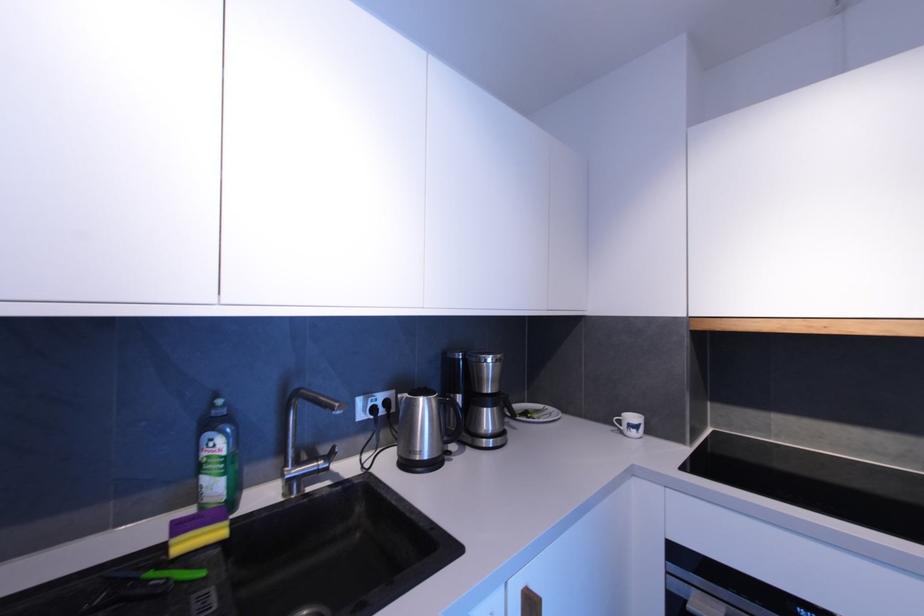
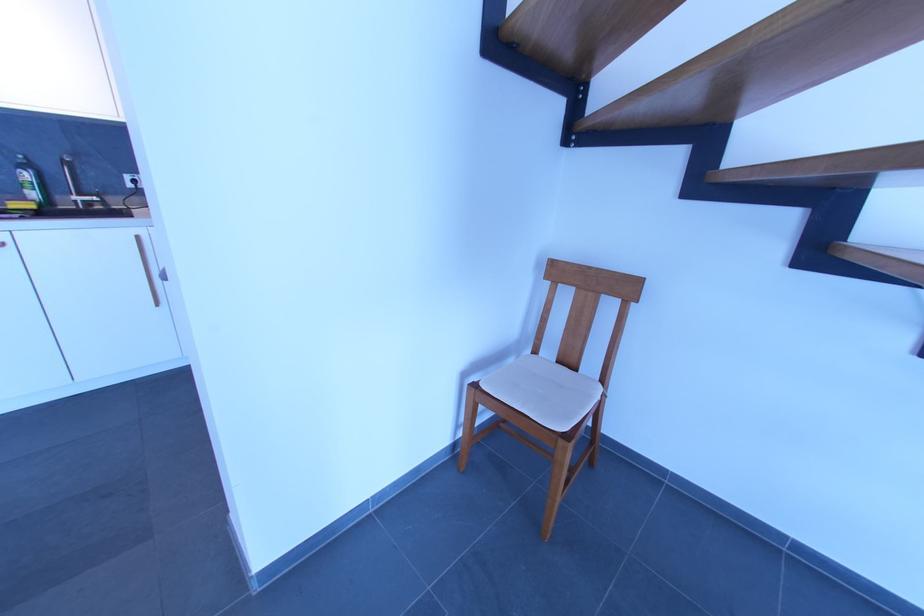
Which direction would the cameraman need to move to produce the second image?

The cameraman moved toward right, backward.